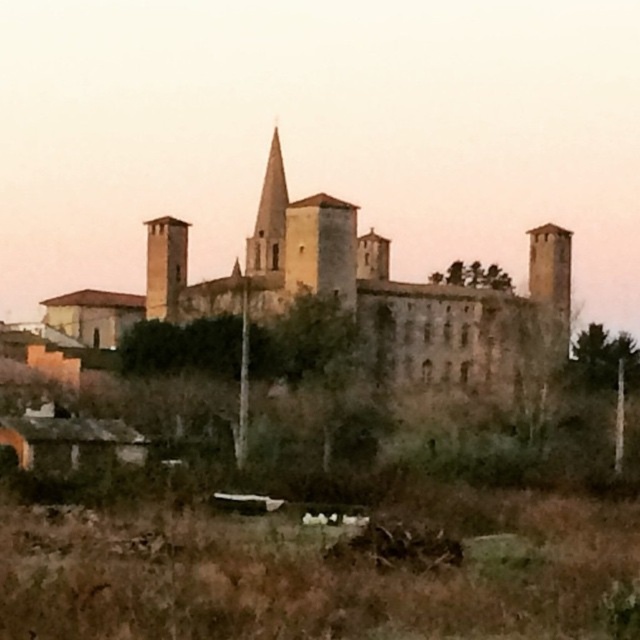
Is the position of brown stone castle at center more distant than that of smooth stone spire at center?

No, it is in front of smooth stone spire at center.

Does brown stone castle at center have a greater height compared to smooth stone spire at center?

Correct, brown stone castle at center is much taller as smooth stone spire at center.

Is point (452, 301) positioned in front of point (280, 266)?

Yes, it is.

At what (x,y) coordinates should I click in order to perform the action: click on brown stone castle at center. Please return your answer as a coordinate pair (x, y). This screenshot has width=640, height=640. Looking at the image, I should click on (404, 298).

Consider the image. Who is taller, stone tower at center-left or smooth stone spire at center?

smooth stone spire at center

Between stone tower at center-left and smooth stone spire at center, which one appears on the left side from the viewer's perspective?

stone tower at center-left is more to the left.

Describe the element at coordinates (164, 266) in the screenshot. Image resolution: width=640 pixels, height=640 pixels. I see `stone tower at center-left` at that location.

The width and height of the screenshot is (640, 640). I want to click on stone tower at center-left, so click(164, 266).

Is point (369, 241) behind point (150, 273)?

Yes, point (369, 241) is farther from viewer.

Can you confirm if brown stone castle at center is wider than stone tower at center-left?

Yes.

Describe the element at coordinates (404, 298) in the screenshot. I see `brown stone castle at center` at that location.

The image size is (640, 640). I want to click on brown stone castle at center, so click(x=404, y=298).